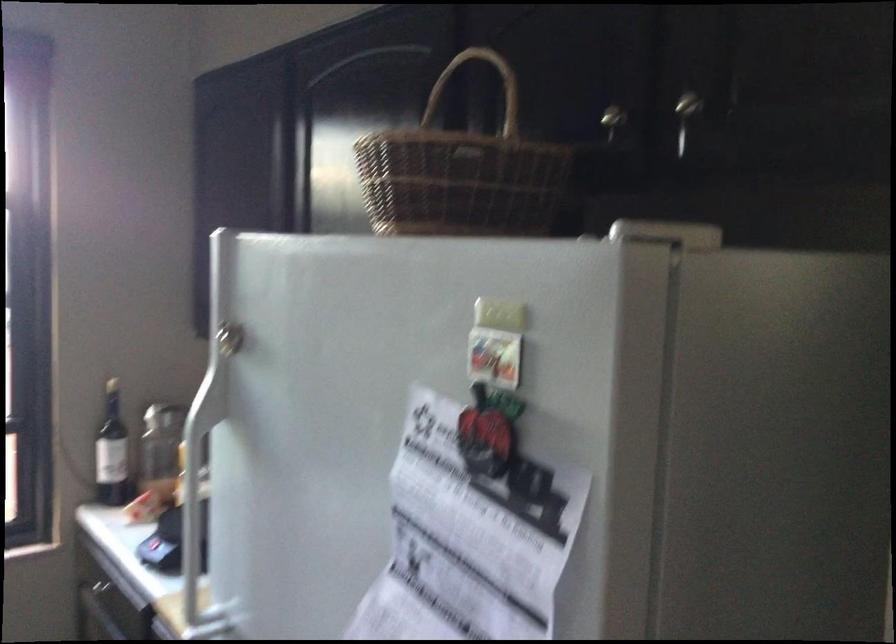
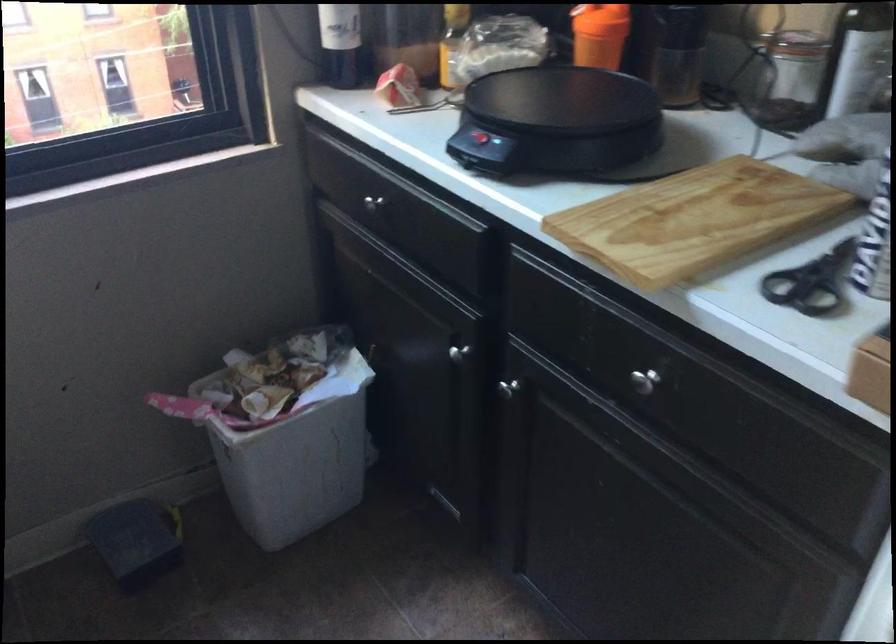
Question: The images are taken continuously from a first-person perspective. In which direction is your viewpoint rotating?

Choices:
 (A) Left
 (B) Right
 (C) Up
 (D) Down

Answer: (D)